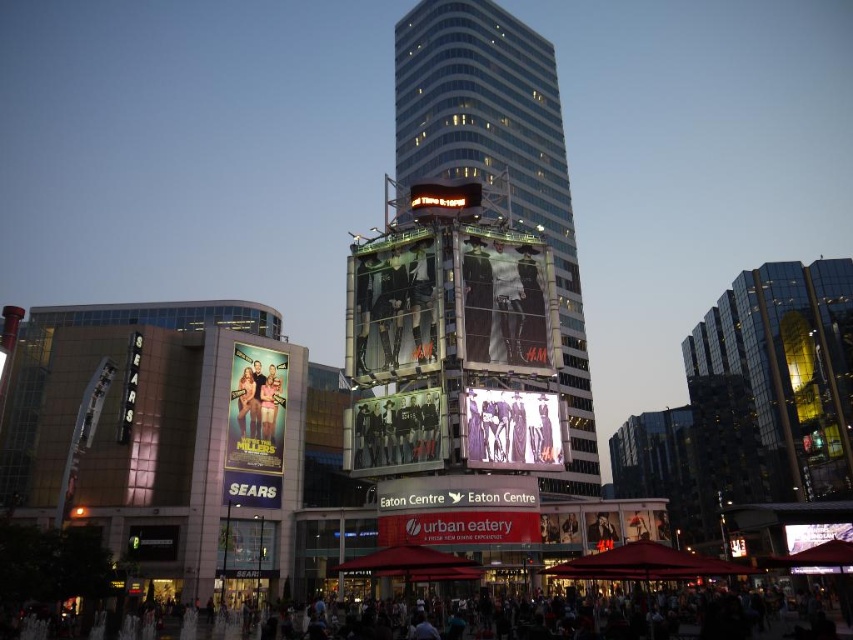
You are standing in the plaza and want to take a photo of both the point at coordinates (x=250, y=356) and the point at coordinates (x=410, y=544). Which point should you focus on first to ensure both are in focus?

You should focus on the point at coordinates (x=250, y=356) first because it is closer to the camera than the point at coordinates (x=410, y=544). This ensures that both points will be in focus when using a camera with a fixed focal plane.

Based on the photo, you are a fashion designer attending a city event and spot a dress at the center of the plaza. The dress is located at point coordinates (512, 429). Can you confirm if the dress is made of a glossy or matte material?

The dress at point (512, 429) is described as matte purple dress at center, so it has a matte material.